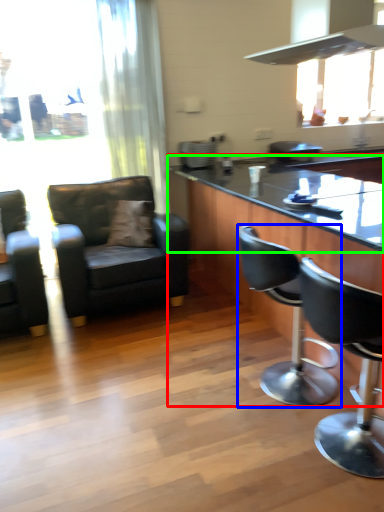
Question: Based on their relative distances, which object is farther from table (highlighted by a red box)? Choose from chair (highlighted by a blue box) and countertop (highlighted by a green box).

Choices:
 (A) chair
 (B) countertop

Answer: (A)